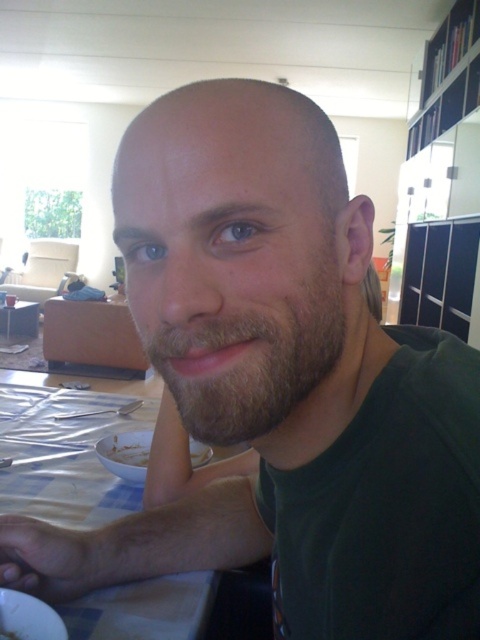
Question: Does white checkered tablecloth at lower left have a larger size compared to brown fuzzy beard at center?

Choices:
 (A) yes
 (B) no

Answer: (A)

Question: Which object is the farthest from the white matte plate at lower left?

Choices:
 (A) white checkered tablecloth at lower left
 (B) wooden table at center
 (C) brown fuzzy beard at center

Answer: (B)

Question: Does wooden table at center appear on the right side of white matte plate at lower left?

Choices:
 (A) no
 (B) yes

Answer: (A)

Question: Based on their relative distances, which object is farther from the brown fuzzy beard at center?

Choices:
 (A) wooden table at center
 (B) white matte plate at lower left
 (C) white checkered tablecloth at lower left

Answer: (A)

Question: Among these points, which one is farthest from the camera?

Choices:
 (A) click(x=280, y=380)
 (B) click(x=136, y=444)
 (C) click(x=14, y=336)

Answer: (C)

Question: Can you confirm if brown fuzzy beard at center is wider than wooden table at center?

Choices:
 (A) no
 (B) yes

Answer: (A)